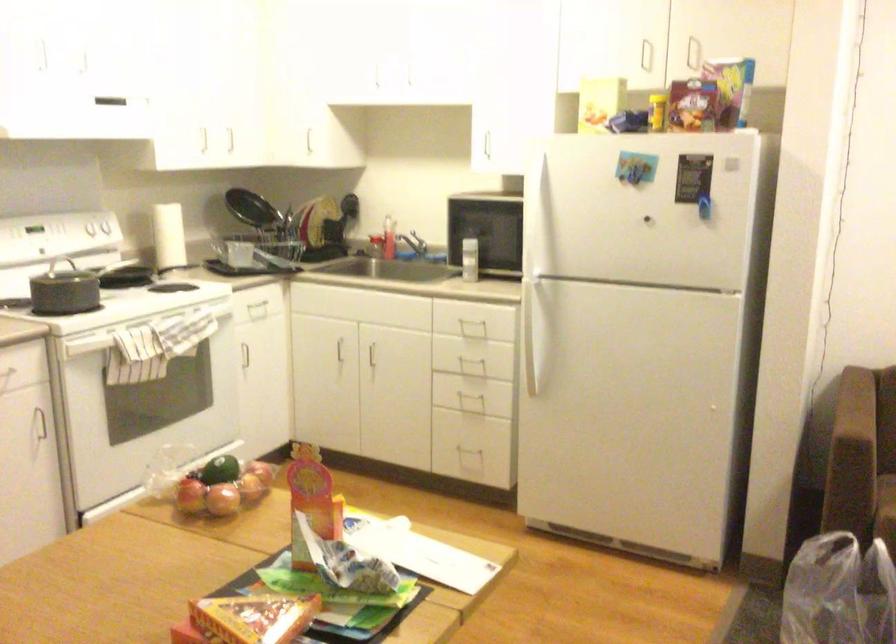
This screenshot has width=896, height=644. I want to click on refrigerator handle, so click(x=536, y=350).